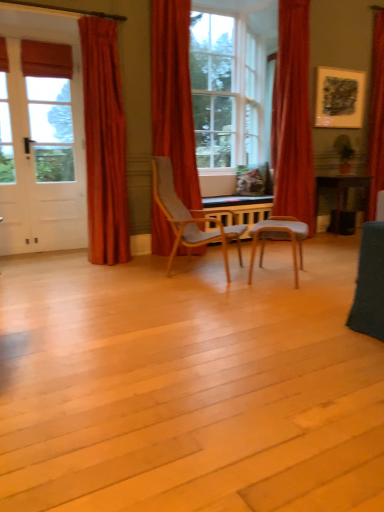
What are the coordinates of `free location in front of light gray fabric chair at center, placed as the first chair when sorted from left to right` in the screenshot? It's located at (198, 294).